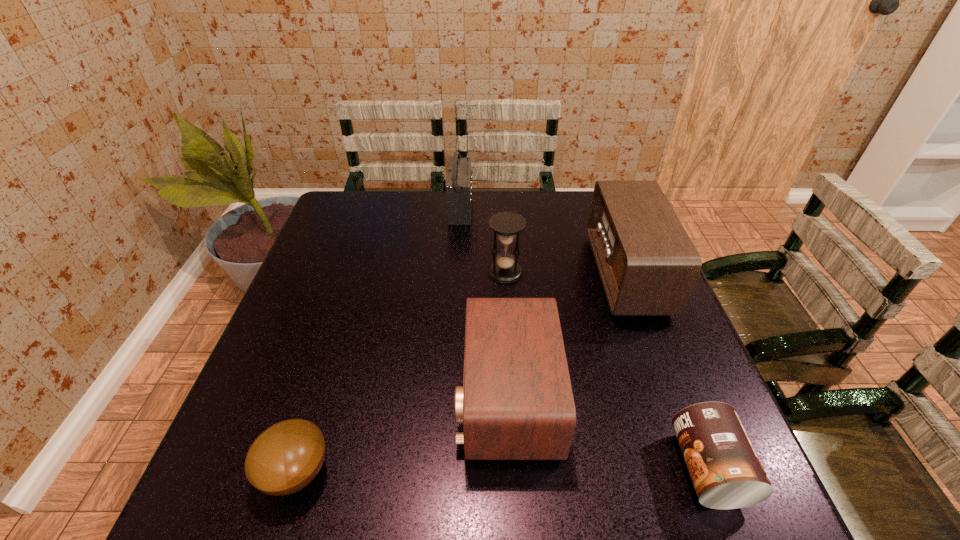
Where is `the farthest object`? This screenshot has width=960, height=540. the farthest object is located at coordinates point(459,185).

Where is `the tallest object`? The width and height of the screenshot is (960, 540). the tallest object is located at coordinates (459, 185).

Find the location of a particular element. This screenshot has height=540, width=960. the second farthest radio receiver is located at coordinates (648, 265).

Find the location of a particular element. The image size is (960, 540). the second tallest radio receiver is located at coordinates (648, 265).

Image resolution: width=960 pixels, height=540 pixels. I want to click on hourglass, so click(x=506, y=226).

You are a GUI agent. You are given a task and a screenshot of the screen. Output one action in this format:
    pyautogui.click(x=<x>, y=<y>)
    Task: Click on the nearest radio receiver
    The width and height of the screenshot is (960, 540).
    Given the screenshot: What is the action you would take?
    pyautogui.click(x=516, y=403)

This screenshot has width=960, height=540. I want to click on the fifth tallest object, so click(725, 470).

Identify the location of the leftmost object. point(286,457).

Image resolution: width=960 pixels, height=540 pixels. Identify the location of the shortest object. (286, 457).

This screenshot has width=960, height=540. What are the coordinates of `free space located 0.310m on the front panel of the tallest object` in the screenshot? It's located at (567, 208).